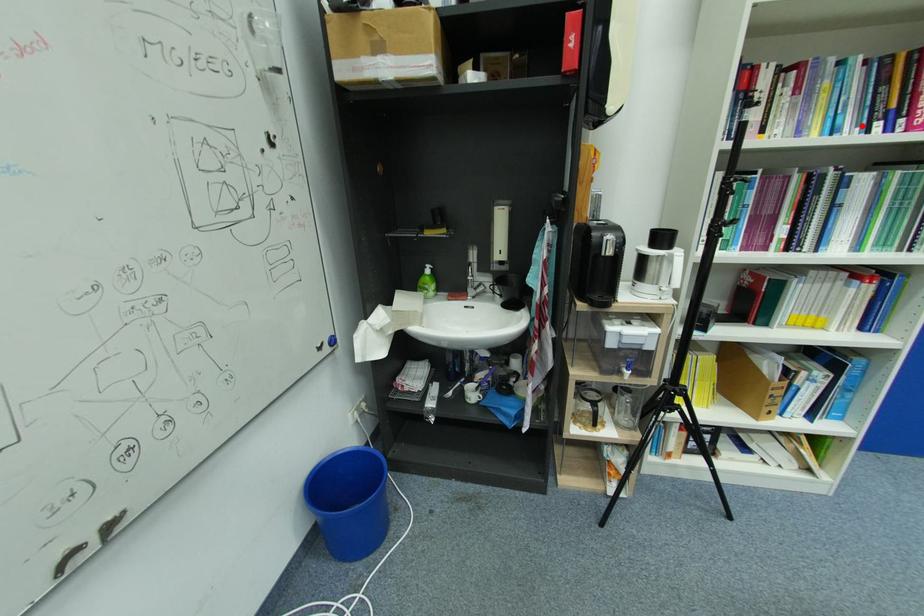
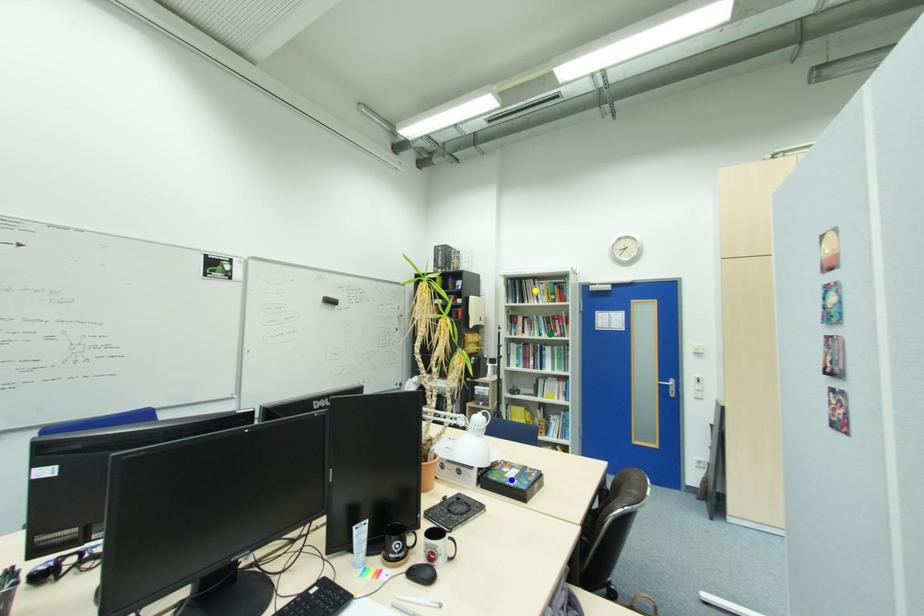
Question: I am providing you with two images of the same scene from different viewpoints. A red point is marked on the first image. You are given multiple points on the second image. Which point in image 2 is actually the same real-world point as the red point in image 1?

Choices:
 (A) yellow point
 (B) green point
 (C) blue point

Answer: (B)